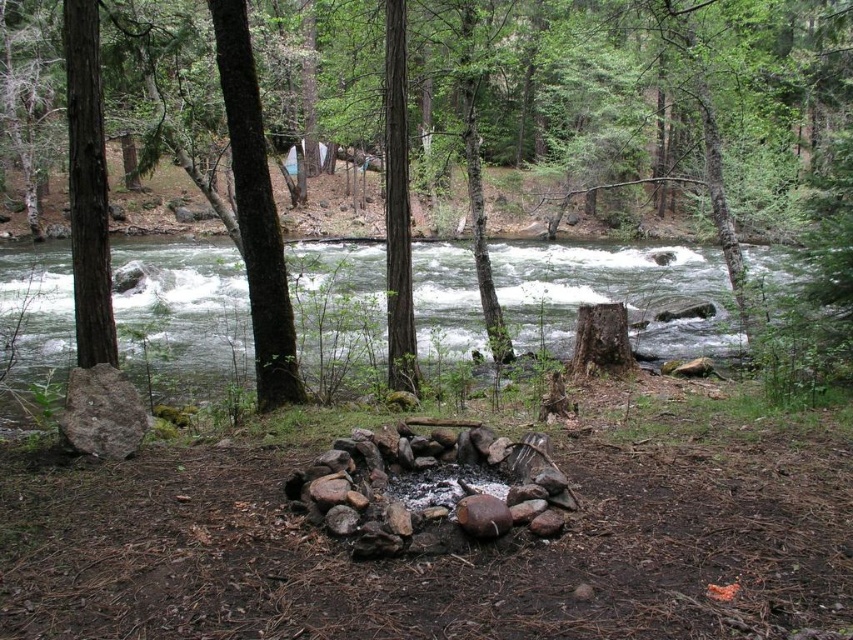
Is brown rough tree trunk at center to the right of brown rough bark tree at left from the viewer's perspective?

Correct, you'll find brown rough tree trunk at center to the right of brown rough bark tree at left.

Identify the location of brown rough tree trunk at center. (648, 182).

From the picture: Which of these two, brown rough bark tree at center or brown rough bark tree at left, stands taller?

With more height is brown rough bark tree at left.

Is brown rough bark tree at center positioned in front of brown rough bark tree at left?

No, it is behind brown rough bark tree at left.

I want to click on brown rough bark tree at center, so click(x=254, y=211).

Between point (202, 332) and point (225, 13), which one is positioned behind?

Positioned behind is point (202, 332).

Is brown rough tree trunk at center below brown rough bark tree at center?

No.

Does point (235, 337) lie behind point (235, 60)?

Yes, it is.

Locate an element on the screen. This screenshot has height=640, width=853. brown rough tree trunk at center is located at coordinates (648, 182).